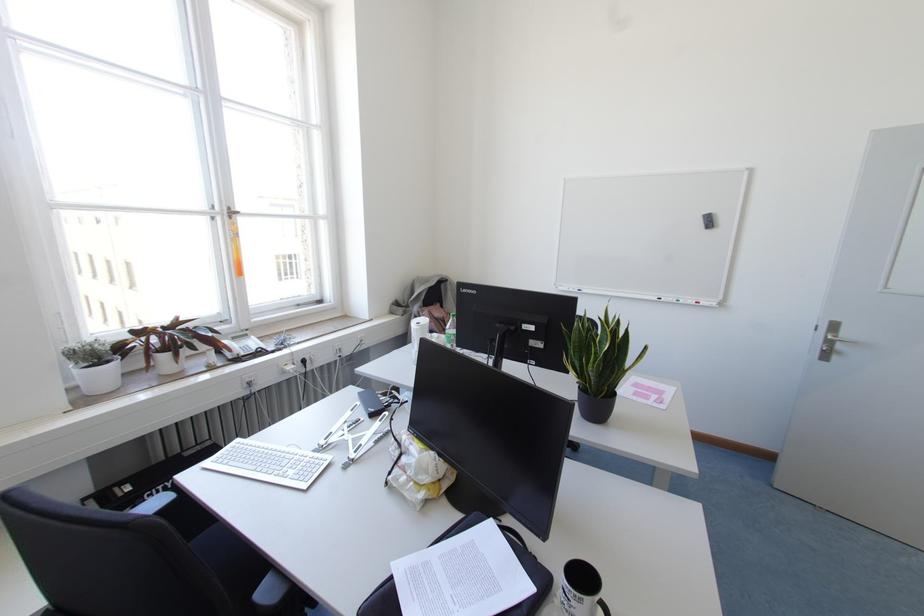
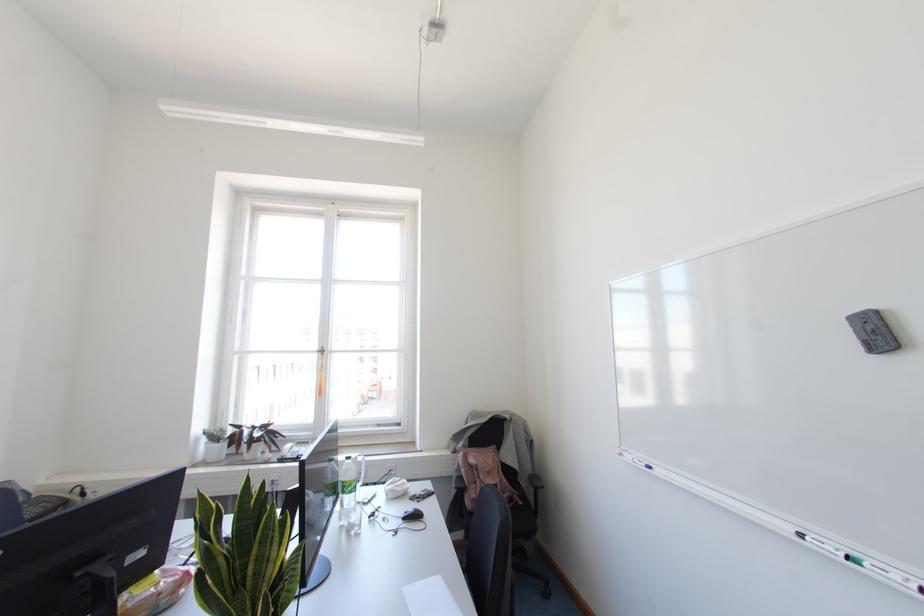
In the second image, find the point that corresponds to (104,344) in the first image.

(223, 431)